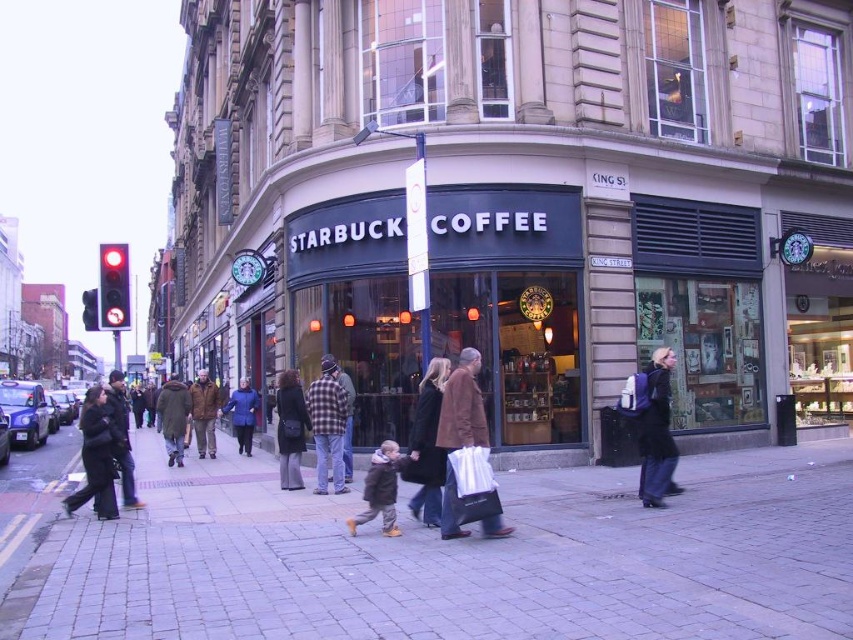
Does dark brown coat at center appear on the right side of dark blue coat at center?

No, dark brown coat at center is not to the right of dark blue coat at center.

Can you confirm if dark brown coat at center is positioned to the left of dark blue coat at center?

Correct, you'll find dark brown coat at center to the left of dark blue coat at center.

Describe the element at coordinates (173, 417) in the screenshot. I see `dark brown coat at center` at that location.

Identify the location of dark brown coat at center. (173, 417).

Describe the element at coordinates (459, 429) in the screenshot. I see `brown leather jacket at center` at that location.

Looking at this image, can you confirm if brown leather jacket at center is positioned above brown woolen jacket at center?

Yes.

Who is more forward, (456, 499) or (200, 449)?

Point (456, 499)

Identify the location of brown leather jacket at center. (459, 429).

Based on the photo, which of these two, dark brown leather coat at center or dark brown leather jacket at lower left, stands taller?

dark brown leather jacket at lower left

Is dark brown leather coat at center above dark brown leather jacket at lower left?

Yes, dark brown leather coat at center is above dark brown leather jacket at lower left.

Is point (421, 460) closer to camera compared to point (115, 420)?

Yes, it is.

The height and width of the screenshot is (640, 853). What are the coordinates of `dark brown leather coat at center` in the screenshot? It's located at (427, 445).